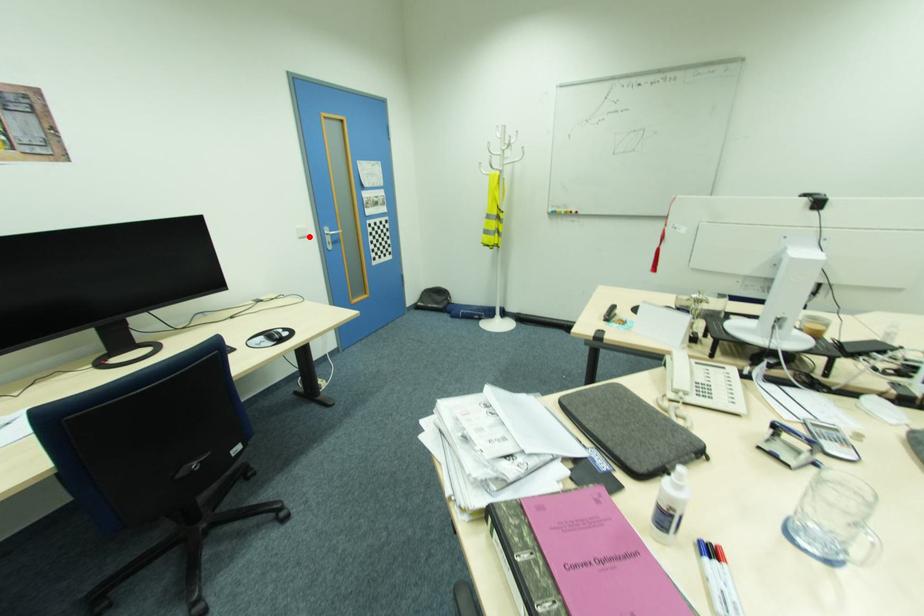
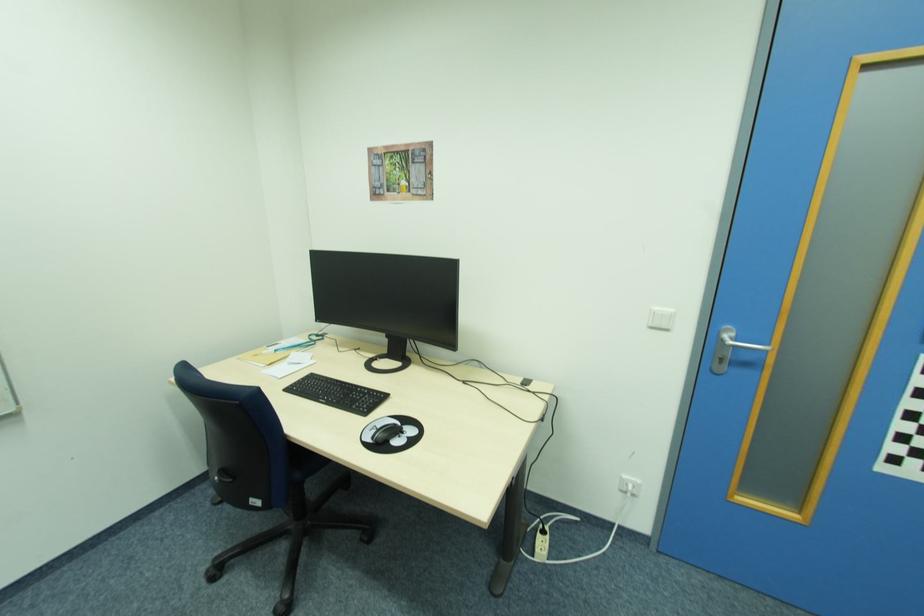
Question: I am providing you with two images of the same scene from different viewpoints. A red point is shown in image1. For the corresponding object point in image2, is it positioned nearer or farther from the camera?

Choices:
 (A) Nearer
 (B) Farther

Answer: (B)